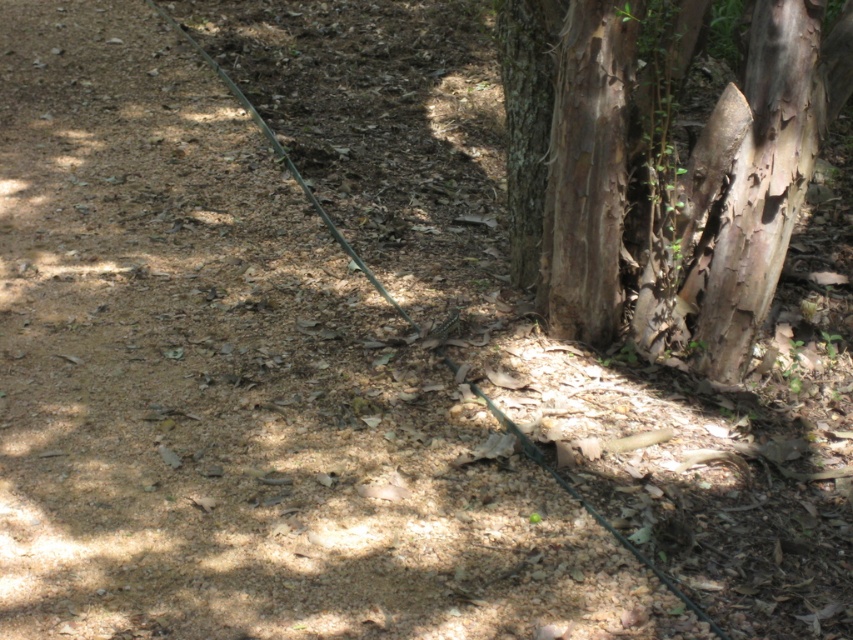
Question: Does smooth bark tree at lower right appear on the left side of light brown textured bark at center right?

Choices:
 (A) yes
 (B) no

Answer: (A)

Question: Which of the following is the farthest from the observer?

Choices:
 (A) (610, 173)
 (B) (718, 307)

Answer: (B)

Question: From the image, what is the correct spatial relationship of smooth bark tree at lower right in relation to brown rough bark tree trunk at center?

Choices:
 (A) left
 (B) right

Answer: (B)

Question: Which object is positioned farthest from the brown rough bark tree trunk at center?

Choices:
 (A) smooth bark tree at lower right
 (B) light brown textured bark at center right

Answer: (B)

Question: Is the position of smooth bark tree at lower right less distant than that of brown rough bark tree trunk at center?

Choices:
 (A) no
 (B) yes

Answer: (B)

Question: Which object is farther from the camera taking this photo?

Choices:
 (A) brown rough bark tree trunk at center
 (B) smooth bark tree at lower right
 (C) light brown textured bark at center right

Answer: (A)